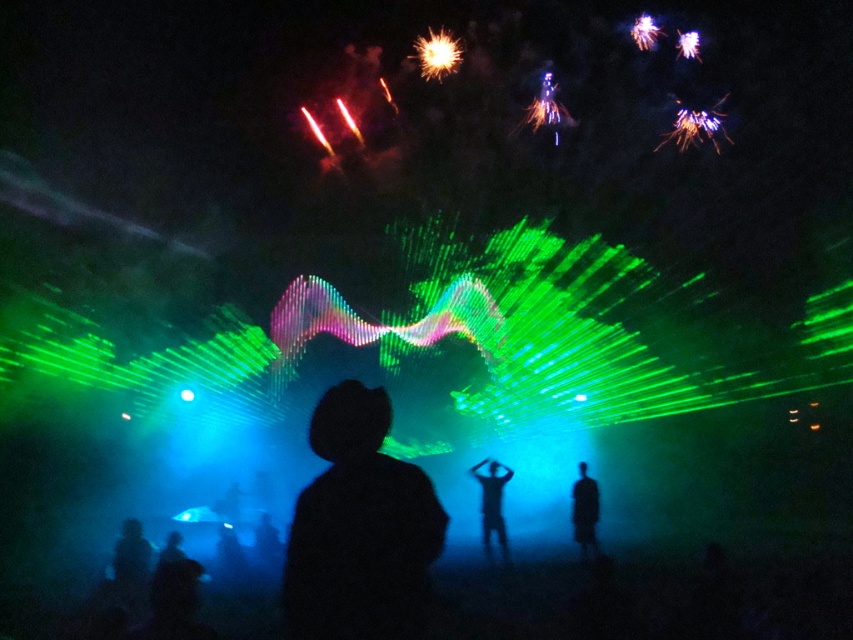
Question: Does black matte jacket at center have a smaller size compared to blue matte person at center?

Choices:
 (A) yes
 (B) no

Answer: (A)

Question: Among these points, which one is nearest to the camera?

Choices:
 (A) (491, 531)
 (B) (409, 496)
 (C) (572, 499)

Answer: (B)

Question: Is black matte person at center closer to the viewer compared to blue matte person at center?

Choices:
 (A) yes
 (B) no

Answer: (B)

Question: Is black matte jacket at center wider than blue matte person at center?

Choices:
 (A) no
 (B) yes

Answer: (B)

Question: Among these points, which one is nearest to the camera?

Choices:
 (A) (575, 509)
 (B) (503, 518)
 (C) (352, 451)

Answer: (C)

Question: Which of the following is the closest to the observer?

Choices:
 (A) black matte person at center
 (B) black matte jacket at center
 (C) blue matte person at center

Answer: (B)